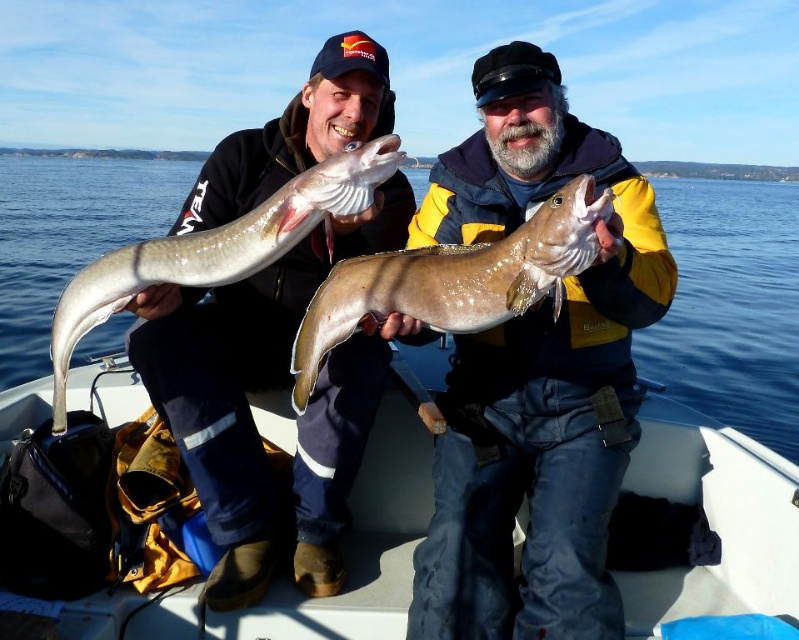
Question: Does shiny silver fish at center appear on the right side of smooth brown fish at center?

Choices:
 (A) yes
 (B) no

Answer: (B)

Question: Which point is closer to the camera taking this photo?

Choices:
 (A) (549, 612)
 (B) (792, 573)
 (C) (336, 189)

Answer: (C)

Question: Considering the real-world distances, which object is farthest from the white plastic boat at center?

Choices:
 (A) translucent water at center
 (B) sleek silver fish at center
 (C) shiny silver fish at center
 (D) smooth brown fish at center

Answer: (A)

Question: Which object is farther from the camera taking this photo?

Choices:
 (A) sleek silver fish at center
 (B) shiny silver fish at center
 (C) smooth brown fish at center

Answer: (A)

Question: From the image, what is the correct spatial relationship of translucent water at center in relation to sleek silver fish at center?

Choices:
 (A) right
 (B) left

Answer: (B)

Question: Can you confirm if shiny silver fish at center is thinner than white plastic boat at center?

Choices:
 (A) yes
 (B) no

Answer: (B)